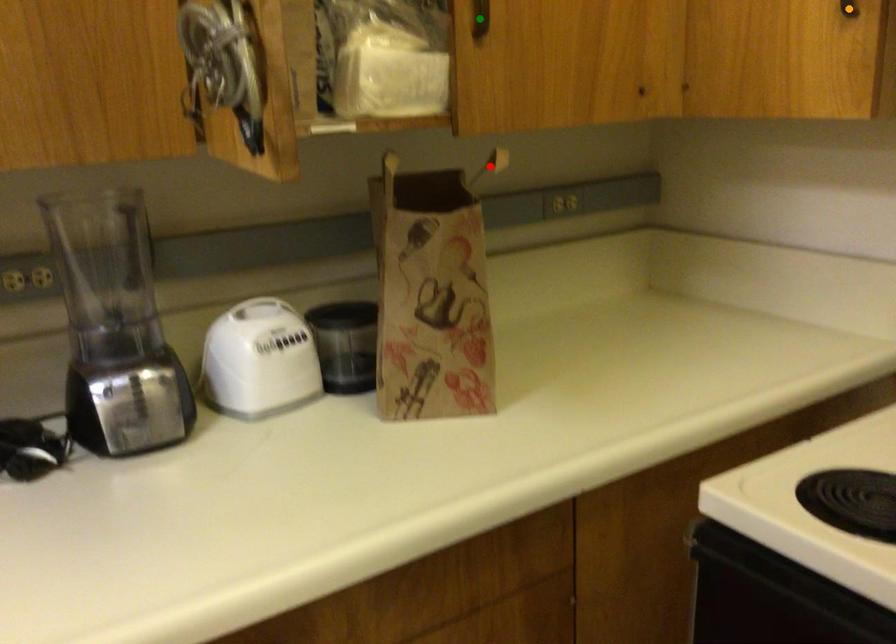
Order these from farthest to nearest:
- green point
- red point
- orange point

red point → green point → orange point